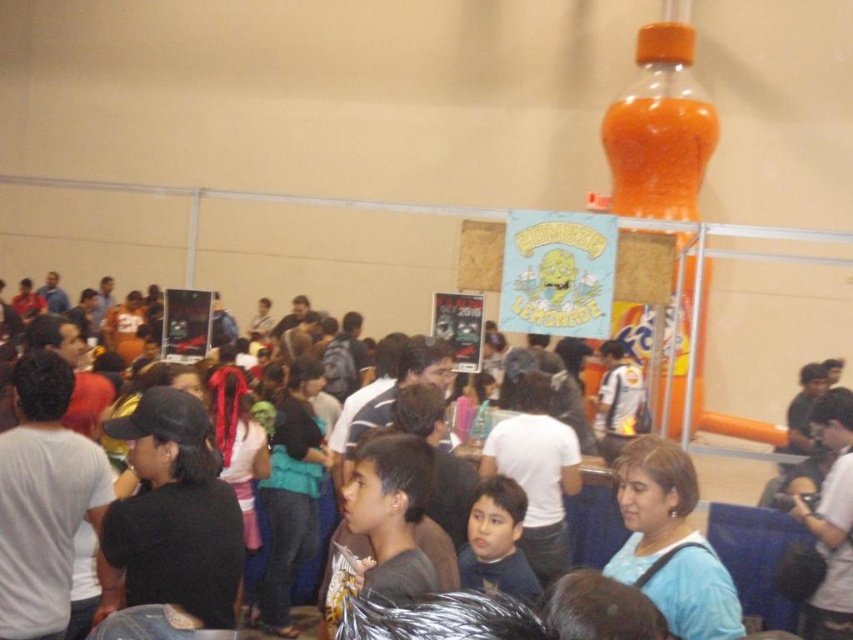
Question: Does matte black shirt at center appear under dark blue shirt at center?

Choices:
 (A) yes
 (B) no

Answer: (A)

Question: Can you confirm if matte black shirt at center is positioned above dark blue shirt at center?

Choices:
 (A) yes
 (B) no

Answer: (B)

Question: Which of the following is the closest to the observer?

Choices:
 (A) 577,513
 (B) 486,515

Answer: (B)

Question: Which point is closer to the camera?

Choices:
 (A) (749, 545)
 (B) (511, 563)

Answer: (B)

Question: Does matte black shirt at center appear on the right side of dark blue shirt at center?

Choices:
 (A) yes
 (B) no

Answer: (A)

Question: Which of the following is the closest to the observer?

Choices:
 (A) matte black shirt at center
 (B) dark blue shirt at center

Answer: (B)